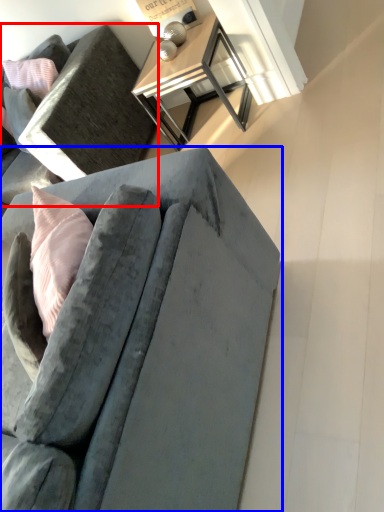
Question: Which object appears farthest to the camera in this image, studio couch (highlighted by a red box) or studio couch (highlighted by a blue box)?

Choices:
 (A) studio couch
 (B) studio couch

Answer: (A)